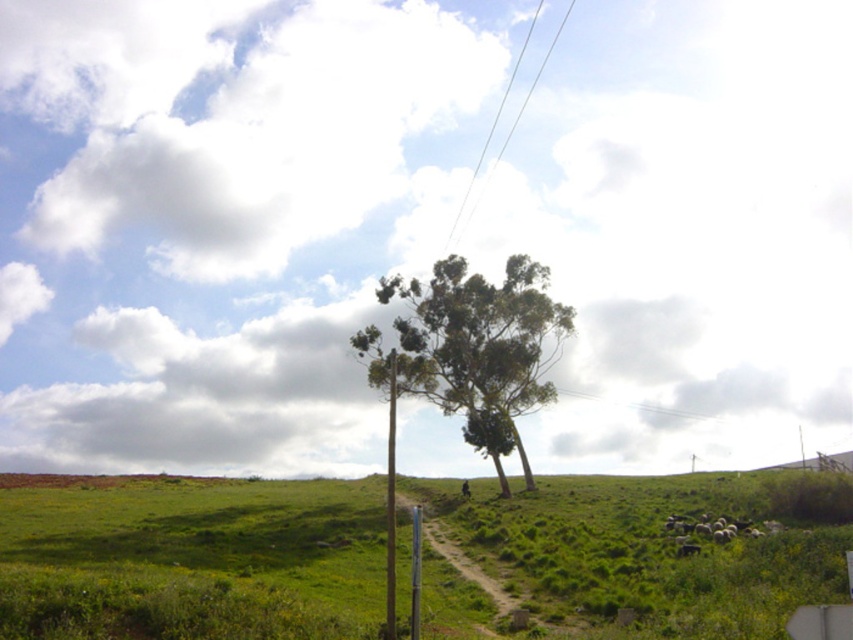
You are standing at the edge of the dirt path and want to walk towards the green leafy tree at center. Which direction should you walk relative to the green grassy hill at center?

You should walk to the right of the green grassy hill at center because the green grassy hill at center is positioned on the left side of the green leafy tree at center.